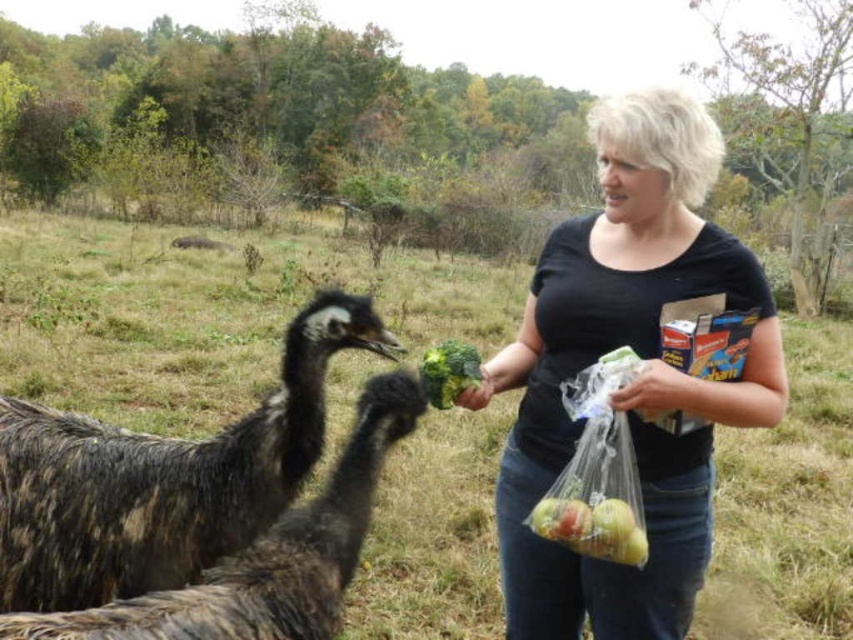
You are a farmer checking the produce in the field. You notice the translucent plastic bag of apples at center and the shiny yellow apples at lower center. Which object has a greater width?

The translucent plastic bag of apples at center has a greater width than the shiny yellow apples at lower center.